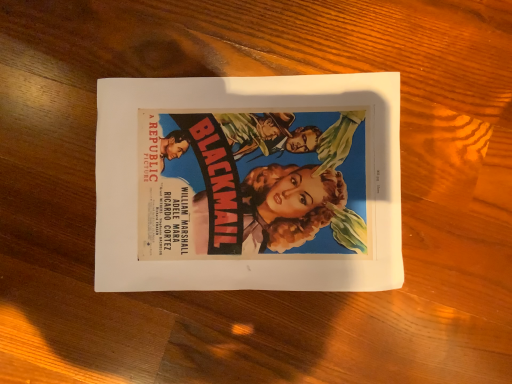
Describe the element at coordinates (249, 184) in the screenshot. This screenshot has height=384, width=512. I see `matte paper poster at center` at that location.

Locate an element on the screen. This screenshot has width=512, height=384. matte paper poster at center is located at coordinates point(249,184).

What is the approximate width of matte paper poster at center?

matte paper poster at center is 8.90 inches wide.

Locate an element on the screen. matte paper poster at center is located at coordinates (249, 184).